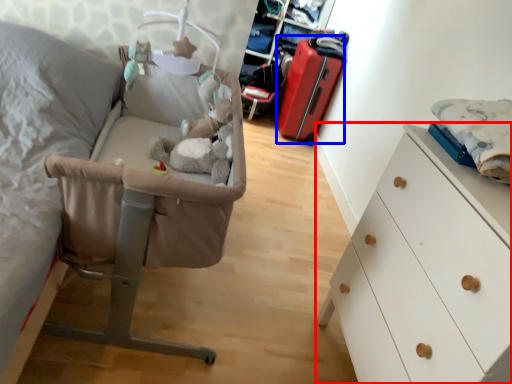
Question: Which point is closer to the camera, chest of drawers (highlighted by a red box) or luggage (highlighted by a blue box)?

Choices:
 (A) chest of drawers
 (B) luggage

Answer: (A)